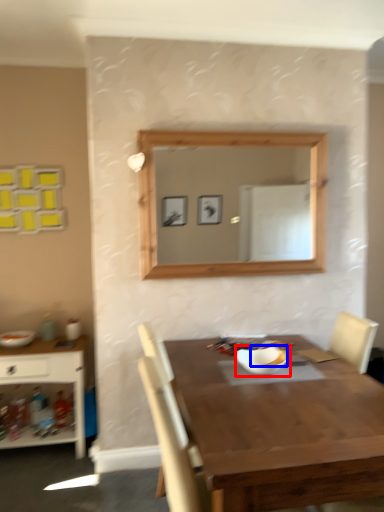
Question: Which point is closer to the camera, bowl (highlighted by a red box) or food (highlighted by a blue box)?

Choices:
 (A) bowl
 (B) food

Answer: (A)